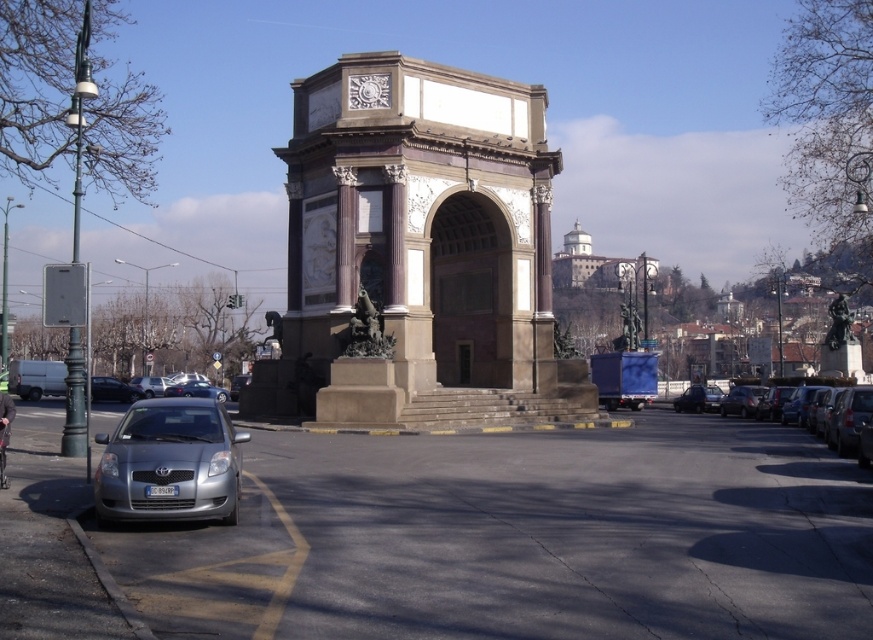
Question: Is silver metallic car at right to the right of bronze statue at right from the viewer's perspective?

Choices:
 (A) yes
 (B) no

Answer: (B)

Question: Which point is farther to the camera?

Choices:
 (A) silver metallic car at right
 (B) bronze statue at center

Answer: (B)

Question: Which object appears farthest from the camera in this image?

Choices:
 (A) bronze statue at right
 (B) brown stone arch at center

Answer: (A)

Question: Does silver metallic car at lower left have a greater width compared to silver metallic car at right?

Choices:
 (A) no
 (B) yes

Answer: (A)

Question: From the image, what is the correct spatial relationship of brown stone arch at center in relation to bronze statue at center?

Choices:
 (A) above
 (B) below

Answer: (A)

Question: Estimate the real-world distances between objects in this image. Which object is closer to the bronze statue at center?

Choices:
 (A) brown stone arch at center
 (B) silver metallic car at right

Answer: (A)